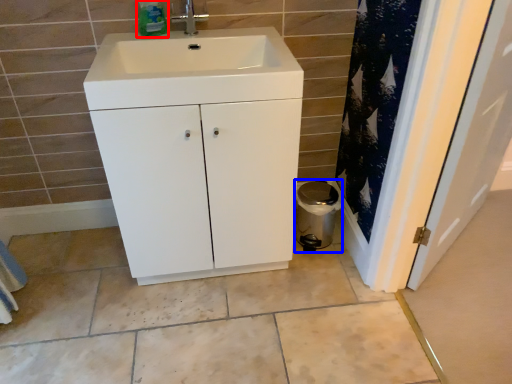
Question: Which object is closer to the camera taking this photo, bottle (highlighted by a red box) or appliance (highlighted by a blue box)?

Choices:
 (A) bottle
 (B) appliance

Answer: (A)